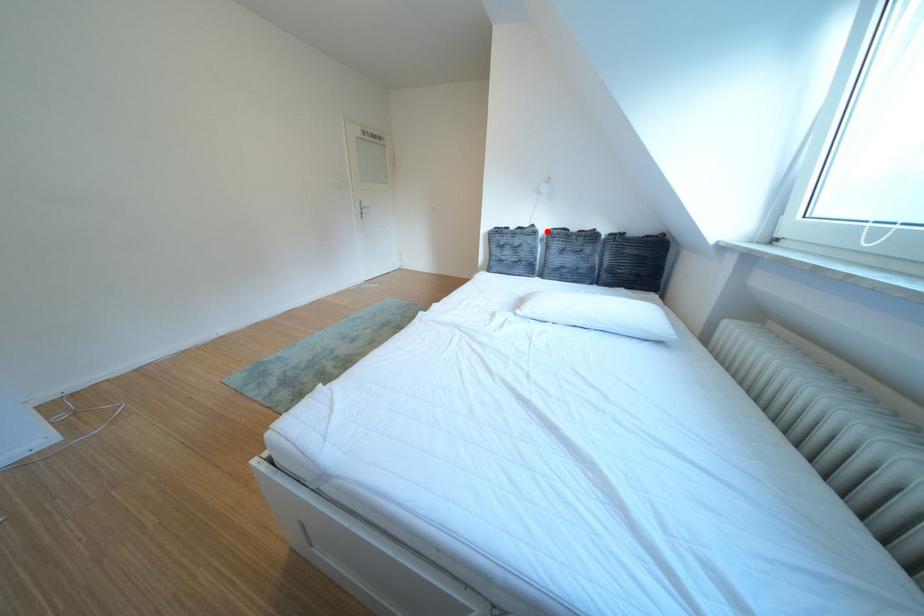
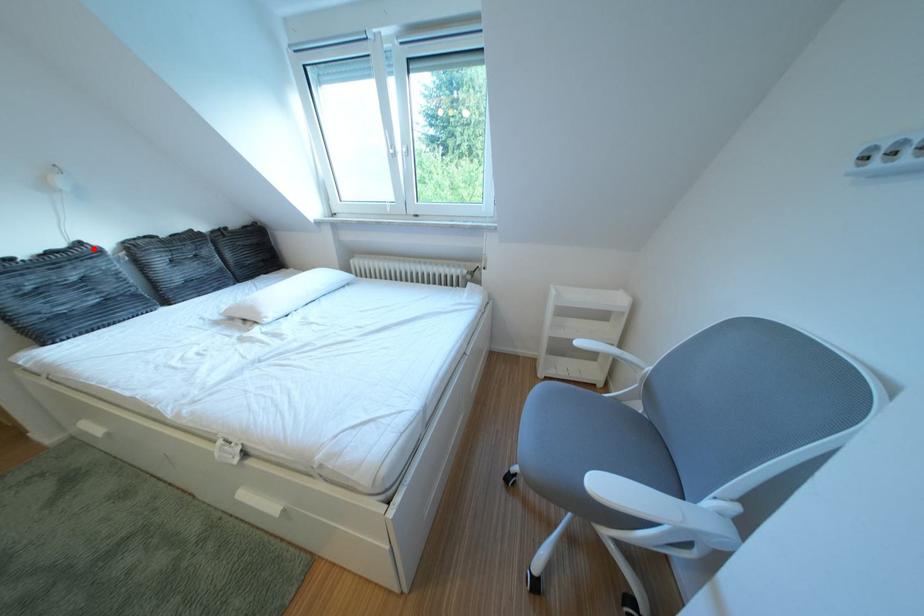
I am providing you with two images of the same scene from different viewpoints. A red point is marked on the first image and another point is marked on the second image. Is the red point in image1 aligned with the point shown in image2?

Yes